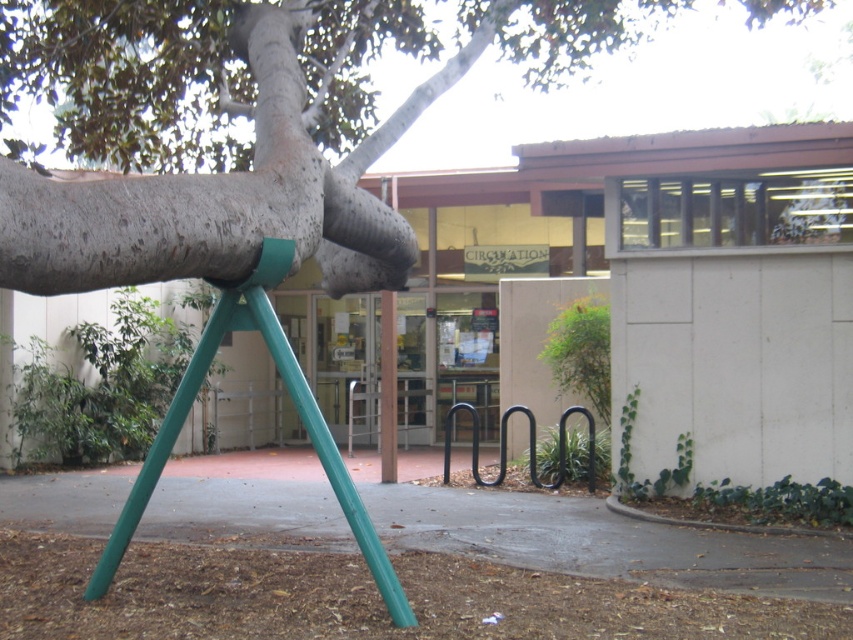
You are a painter standing at the base of the tree. You need to paint both the smooth gray bark at upper center and the green metallic tripod at center. Which object will require more paint due to its size?

The smooth gray bark at upper center has a larger size compared to the green metallic tripod at center, so it will require more paint.

You are standing at the entrance of the building and want to walk to the point marked at coordinate point (413,49). However, there is an obstacle at point (323,440). Will you be able to see the target point without moving around the obstacle?

Since point (413,49) is behind point (323,440) from your current position at the entrance, the obstacle at point (323,440) will block your direct line of sight to the target point. You will need to move around the obstacle to see it.